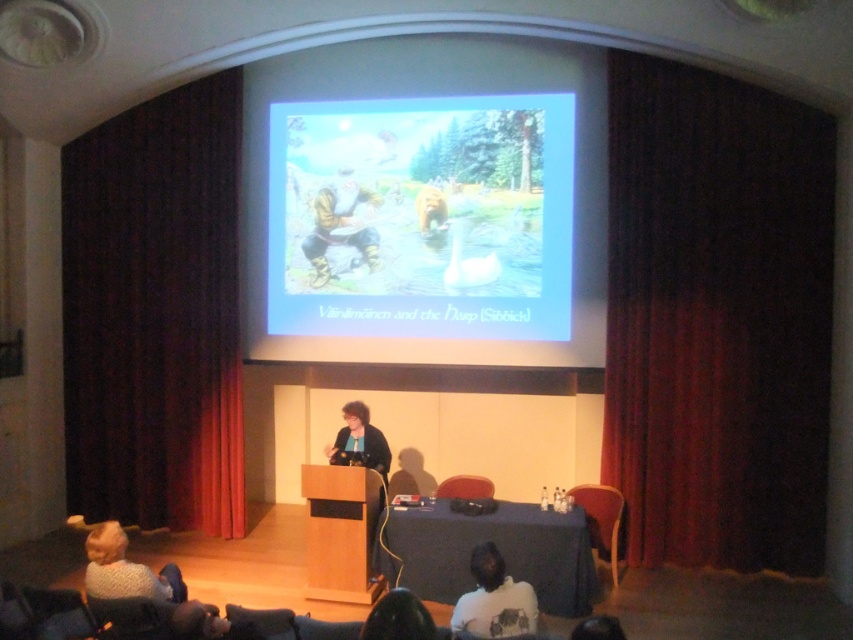
Does dark velvet curtain at right appear over white matte shirt at lower center?

Yes.

Looking at this image, does dark velvet curtain at right appear on the left side of white matte shirt at lower center?

No, dark velvet curtain at right is not to the left of white matte shirt at lower center.

What do you see at coordinates (717, 317) in the screenshot? I see `dark velvet curtain at right` at bounding box center [717, 317].

Locate an element on the screen. dark velvet curtain at right is located at coordinates (717, 317).

Which is below, white matte shirt at lower center or beige fabric bag at center?

white matte shirt at lower center is lower down.

Who is more distant from viewer, (x=479, y=548) or (x=349, y=182)?

The point (x=349, y=182) is more distant.

Where is `white matte shirt at lower center`? The image size is (853, 640). white matte shirt at lower center is located at coordinates (494, 600).

Between dark red velvet curtain at left and white matte shirt at lower center, which one has less height?

With less height is white matte shirt at lower center.

Measure the distance between dark red velvet curtain at left and camera.

A distance of 21.32 feet exists between dark red velvet curtain at left and camera.

Between point (108, 461) and point (479, 573), which one is positioned in front?

Positioned in front is point (479, 573).

In order to click on dark red velvet curtain at left in this screenshot , I will do click(154, 314).